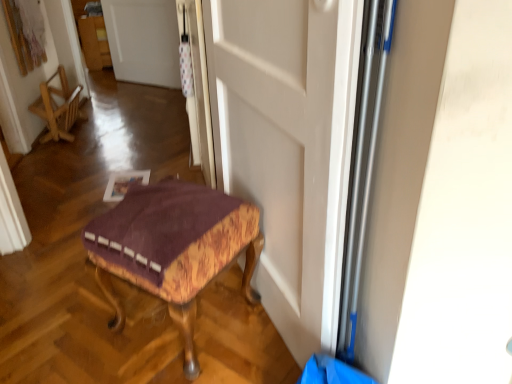
Question: Should I look upward or downward to see white glossy door at upper center, which is the first door from top to bottom?

Choices:
 (A) up
 (B) down

Answer: (A)

Question: From a real-world perspective, is wooden chair at left on white matte door at center, the second door when ordered from top to bottom?

Choices:
 (A) yes
 (B) no

Answer: (B)

Question: Is wooden chair at left aimed at white matte door at center, which is counted as the first door, starting from the front?

Choices:
 (A) yes
 (B) no

Answer: (B)

Question: Are wooden chair at left and white matte door at center, the second door when ordered from top to bottom, making contact?

Choices:
 (A) no
 (B) yes

Answer: (A)

Question: Can you confirm if wooden chair at left is smaller than white matte door at center, the second door positioned from the left?

Choices:
 (A) no
 (B) yes

Answer: (B)

Question: Considering the relative sizes of wooden chair at left and white matte door at center, which is counted as the first door, starting from the front, in the image provided, is wooden chair at left bigger than white matte door at center, which is counted as the first door, starting from the front,?

Choices:
 (A) yes
 (B) no

Answer: (B)

Question: Is the position of wooden chair at left less distant than that of white matte door at center, which is counted as the first door, starting from the front?

Choices:
 (A) no
 (B) yes

Answer: (A)

Question: Does velvet purple cushioned stool at lower center come in front of white glossy door at upper center, which is the second door in front-to-back order?

Choices:
 (A) yes
 (B) no

Answer: (A)

Question: Is velvet purple cushioned stool at lower center next to white glossy door at upper center, which ranks as the first door in left-to-right order?

Choices:
 (A) no
 (B) yes

Answer: (A)

Question: Is velvet purple cushioned stool at lower center smaller than white glossy door at upper center, positioned as the first door in back-to-front order?

Choices:
 (A) yes
 (B) no

Answer: (B)

Question: Does velvet purple cushioned stool at lower center appear on the right side of white glossy door at upper center, the second door ordered from the bottom?

Choices:
 (A) yes
 (B) no

Answer: (A)

Question: Is velvet purple cushioned stool at lower center positioned far away from white glossy door at upper center, positioned as the first door in back-to-front order?

Choices:
 (A) no
 (B) yes

Answer: (B)

Question: Is velvet purple cushioned stool at lower center aimed at white glossy door at upper center, positioned as the first door in back-to-front order?

Choices:
 (A) yes
 (B) no

Answer: (B)

Question: Can you confirm if wooden chair at left is positioned to the right of white glossy door at upper center, which ranks as the first door in left-to-right order?

Choices:
 (A) no
 (B) yes

Answer: (A)